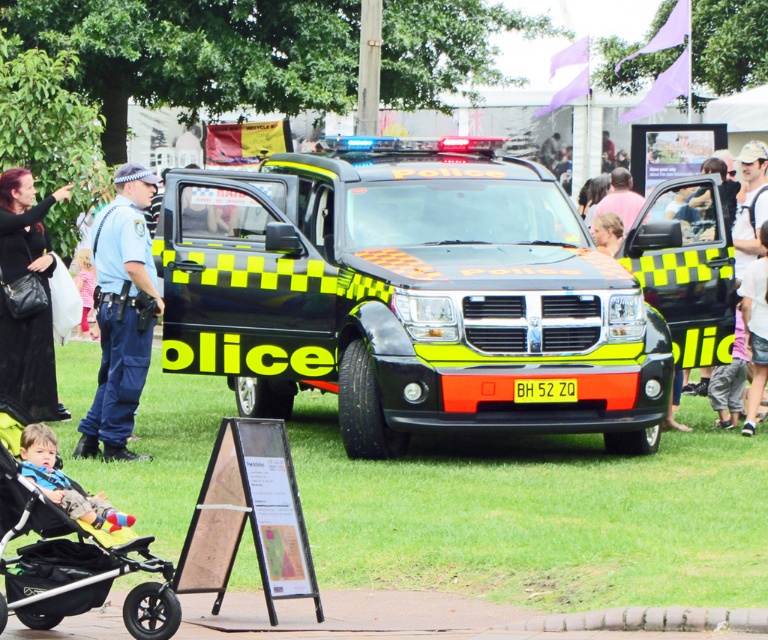
Question: Does blue uniformed officer at left appear on the left side of black leather handbag at left?

Choices:
 (A) yes
 (B) no

Answer: (B)

Question: Which point is farther to the camera?

Choices:
 (A) neon yellow/green checkered police vehicle at center
 (B) soft blue fabric baby at lower left
 (C) blue uniformed officer at left
 (D) black plastic baby carriage at lower left

Answer: (A)

Question: Which object is the farthest from the soft blue fabric baby at lower left?

Choices:
 (A) black leather handbag at left
 (B) black plastic baby carriage at lower left
 (C) neon yellow/green checkered police vehicle at center

Answer: (A)

Question: Is black plastic baby carriage at lower left smaller than black leather handbag at left?

Choices:
 (A) no
 (B) yes

Answer: (B)

Question: Which is nearer to the blue uniformed officer at left?

Choices:
 (A) soft blue fabric baby at lower left
 (B) neon yellow/green checkered police vehicle at center
 (C) black leather handbag at left
 (D) black plastic baby carriage at lower left

Answer: (C)

Question: Is blue uniformed officer at left thinner than black leather handbag at left?

Choices:
 (A) no
 (B) yes

Answer: (A)